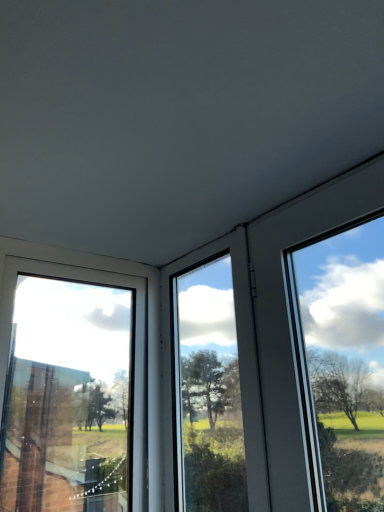
Measure the distance between transparent glass window at center, placed as the first window when sorted from right to left, and camera.

3.29 feet.

The image size is (384, 512). What do you see at coordinates (221, 369) in the screenshot? I see `transparent glass window at center, placed as the first window when sorted from right to left` at bounding box center [221, 369].

At what (x,y) coordinates should I click in order to perform the action: click on transparent glass window at center, arranged as the 2th window when viewed from the left. Please return your answer as a coordinate pair (x, y). The height and width of the screenshot is (512, 384). Looking at the image, I should click on (221, 369).

You are a GUI agent. You are given a task and a screenshot of the screen. Output one action in this format:
    pyautogui.click(x=<x>, y=<y>)
    Task: Click on the transparent glass window at left, marked as the first window in a left-to-right arrangement
    This screenshot has height=512, width=384.
    Given the screenshot: What is the action you would take?
    pyautogui.click(x=71, y=389)

Measure the distance between point (141,430) and camera.

Point (141,430) and camera are 4.50 feet apart.

Describe the element at coordinates (71, 389) in the screenshot. I see `transparent glass window at left, marked as the first window in a left-to-right arrangement` at that location.

You are a GUI agent. You are given a task and a screenshot of the screen. Output one action in this format:
    pyautogui.click(x=<x>, y=<y>)
    Task: Click on the transparent glass window at center, arranged as the 2th window when viewed from the left
    This screenshot has height=512, width=384.
    Given the screenshot: What is the action you would take?
    pyautogui.click(x=221, y=369)

Which object is positioned more to the right, transparent glass window at center, placed as the first window when sorted from right to left, or transparent glass window at left, marked as the first window in a left-to-right arrangement?

From the viewer's perspective, transparent glass window at center, placed as the first window when sorted from right to left, appears more on the right side.

Considering their positions, is transparent glass window at center, arranged as the 2th window when viewed from the left, located in front of or behind transparent glass window at left, marked as the first window in a left-to-right arrangement?

Visually, transparent glass window at center, arranged as the 2th window when viewed from the left, is located behind transparent glass window at left, marked as the first window in a left-to-right arrangement.

Between point (235, 469) and point (38, 317), which one is positioned behind?

Point (38, 317)

From the image's perspective, which is below, transparent glass window at center, arranged as the 2th window when viewed from the left, or transparent glass window at left, which ranks as the second window in right-to-left order?

transparent glass window at left, which ranks as the second window in right-to-left order, appears lower in the image.

In the scene shown: From a real-world perspective, does transparent glass window at center, placed as the first window when sorted from right to left, sit lower than transparent glass window at left, which ranks as the second window in right-to-left order?

No.

Which object is wider, transparent glass window at center, arranged as the 2th window when viewed from the left, or transparent glass window at left, which ranks as the second window in right-to-left order?

transparent glass window at left, which ranks as the second window in right-to-left order, is wider.

Considering the relative sizes of transparent glass window at center, placed as the first window when sorted from right to left, and transparent glass window at left, marked as the first window in a left-to-right arrangement, in the image provided, is transparent glass window at center, placed as the first window when sorted from right to left, shorter than transparent glass window at left, marked as the first window in a left-to-right arrangement,?

No, transparent glass window at center, placed as the first window when sorted from right to left, is not shorter than transparent glass window at left, marked as the first window in a left-to-right arrangement.

Considering the relative sizes of transparent glass window at center, arranged as the 2th window when viewed from the left, and transparent glass window at left, which ranks as the second window in right-to-left order, in the image provided, is transparent glass window at center, arranged as the 2th window when viewed from the left, smaller than transparent glass window at left, which ranks as the second window in right-to-left order,?

Indeed, transparent glass window at center, arranged as the 2th window when viewed from the left, has a smaller size compared to transparent glass window at left, which ranks as the second window in right-to-left order.

Which is correct: transparent glass window at center, placed as the first window when sorted from right to left, is inside transparent glass window at left, which ranks as the second window in right-to-left order, or outside of it?

transparent glass window at center, placed as the first window when sorted from right to left, is spatially situated outside transparent glass window at left, which ranks as the second window in right-to-left order.

Is transparent glass window at center, placed as the first window when sorted from right to left, touching transparent glass window at left, which ranks as the second window in right-to-left order?

No, transparent glass window at center, placed as the first window when sorted from right to left, is not in contact with transparent glass window at left, which ranks as the second window in right-to-left order.

Could you tell me if transparent glass window at center, placed as the first window when sorted from right to left, is facing transparent glass window at left, which ranks as the second window in right-to-left order?

Yes, transparent glass window at center, placed as the first window when sorted from right to left, is oriented towards transparent glass window at left, which ranks as the second window in right-to-left order.

What's the angular difference between transparent glass window at center, arranged as the 2th window when viewed from the left, and transparent glass window at left, which ranks as the second window in right-to-left order,'s facing directions?

The angular difference between transparent glass window at center, arranged as the 2th window when viewed from the left, and transparent glass window at left, which ranks as the second window in right-to-left order, is 90 degrees.

At what (x,y) coordinates should I click in order to perform the action: click on window behind the transparent glass window at left, which ranks as the second window in right-to-left order. Please return your answer as a coordinate pair (x, y). Image resolution: width=384 pixels, height=512 pixels. Looking at the image, I should click on (221, 369).

Which object is positioned more to the right, transparent glass window at left, which ranks as the second window in right-to-left order, or transparent glass window at center, arranged as the 2th window when viewed from the left?

transparent glass window at center, arranged as the 2th window when viewed from the left.

Which object is further away from the camera, transparent glass window at left, which ranks as the second window in right-to-left order, or transparent glass window at center, placed as the first window when sorted from right to left?

Positioned behind is transparent glass window at center, placed as the first window when sorted from right to left.

Which is farther, (x=6, y=399) or (x=245, y=459)?

Positioned behind is point (x=6, y=399).

From the image's perspective, is transparent glass window at left, marked as the first window in a left-to-right arrangement, above transparent glass window at center, arranged as the 2th window when viewed from the left?

No, from the image's perspective, transparent glass window at left, marked as the first window in a left-to-right arrangement, is not over transparent glass window at center, arranged as the 2th window when viewed from the left.

From a real-world perspective, is transparent glass window at left, marked as the first window in a left-to-right arrangement, below transparent glass window at center, placed as the first window when sorted from right to left?

Yes, from a real-world perspective, transparent glass window at left, marked as the first window in a left-to-right arrangement, is under transparent glass window at center, placed as the first window when sorted from right to left.

Is transparent glass window at left, marked as the first window in a left-to-right arrangement, wider or thinner than transparent glass window at center, placed as the first window when sorted from right to left?

In the image, transparent glass window at left, marked as the first window in a left-to-right arrangement, appears to be wider than transparent glass window at center, placed as the first window when sorted from right to left.

Between transparent glass window at left, marked as the first window in a left-to-right arrangement, and transparent glass window at center, arranged as the 2th window when viewed from the left, which one has more height?

transparent glass window at center, arranged as the 2th window when viewed from the left, is taller.

Can you confirm if transparent glass window at left, marked as the first window in a left-to-right arrangement, is smaller than transparent glass window at center, placed as the first window when sorted from right to left?

Actually, transparent glass window at left, marked as the first window in a left-to-right arrangement, might be larger than transparent glass window at center, placed as the first window when sorted from right to left.

Is transparent glass window at center, placed as the first window when sorted from right to left, surrounded by transparent glass window at left, which ranks as the second window in right-to-left order?

No, transparent glass window at left, which ranks as the second window in right-to-left order, does not contain transparent glass window at center, placed as the first window when sorted from right to left.

Looking at this image, is there a large distance between transparent glass window at left, marked as the first window in a left-to-right arrangement, and transparent glass window at center, arranged as the 2th window when viewed from the left?

No, transparent glass window at left, marked as the first window in a left-to-right arrangement, is in close proximity to transparent glass window at center, arranged as the 2th window when viewed from the left.

Is transparent glass window at left, which ranks as the second window in right-to-left order, oriented away from transparent glass window at center, placed as the first window when sorted from right to left?

transparent glass window at left, which ranks as the second window in right-to-left order, is not turned away from transparent glass window at center, placed as the first window when sorted from right to left.

What's the angular difference between transparent glass window at left, marked as the first window in a left-to-right arrangement, and transparent glass window at center, arranged as the 2th window when viewed from the left,'s facing directions?

transparent glass window at left, marked as the first window in a left-to-right arrangement, and transparent glass window at center, arranged as the 2th window when viewed from the left, are facing 90 degrees away from each other.

The image size is (384, 512). In order to click on window in front of the transparent glass window at center, arranged as the 2th window when viewed from the left in this screenshot , I will do `click(71, 389)`.

Image resolution: width=384 pixels, height=512 pixels. I want to click on window on the right of transparent glass window at left, marked as the first window in a left-to-right arrangement, so coord(221,369).

Locate an element on the screen. The image size is (384, 512). window that appears on the left of transparent glass window at center, placed as the first window when sorted from right to left is located at coordinates (71, 389).